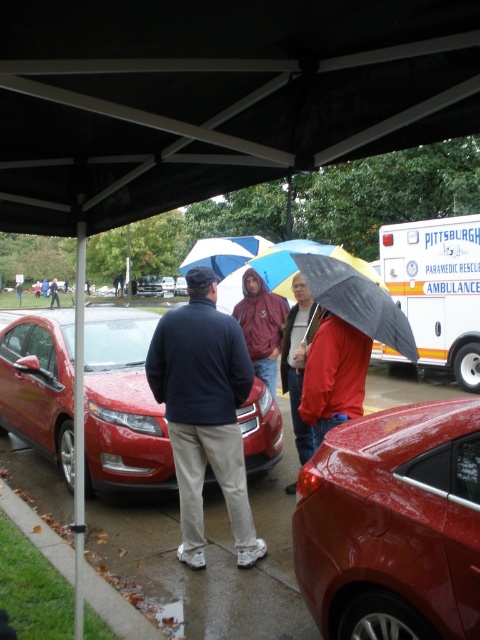
Question: Among these points, which one is nearest to the camera?

Choices:
 (A) (267, 378)
 (B) (57, 305)
 (C) (205, 253)
 (D) (420, 246)

Answer: (A)

Question: Is shiny red sedan at center above blue and white striped umbrella at center?

Choices:
 (A) yes
 (B) no

Answer: (B)

Question: Is black matte umbrella at center thinner than dark blue jacket at center?

Choices:
 (A) yes
 (B) no

Answer: (A)

Question: Which point is closer to the camera taking this photo?

Choices:
 (A) (322, 246)
 (B) (472, 266)
 (C) (183, 284)
 (D) (237, 257)

Answer: (A)

Question: Which object is farther from the camera taking this photo?

Choices:
 (A) black matte canopy at upper center
 (B) maroon hoodie at center
 (C) white glossy ambulance at center
 (D) dark blue jacket at center

Answer: (D)

Question: From the image, what is the correct spatial relationship of dark blue sweater at center in relation to red matte jacket at center?

Choices:
 (A) right
 (B) left

Answer: (B)